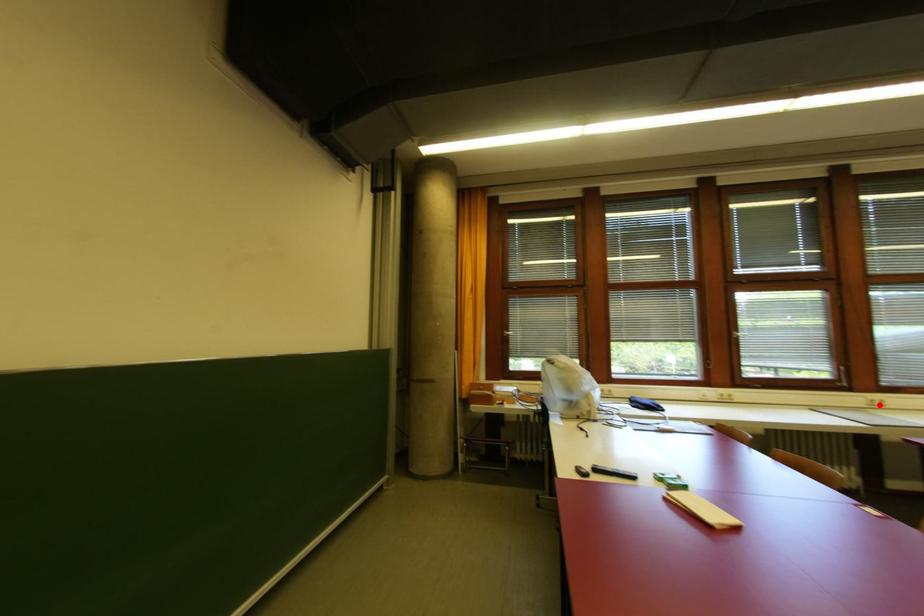
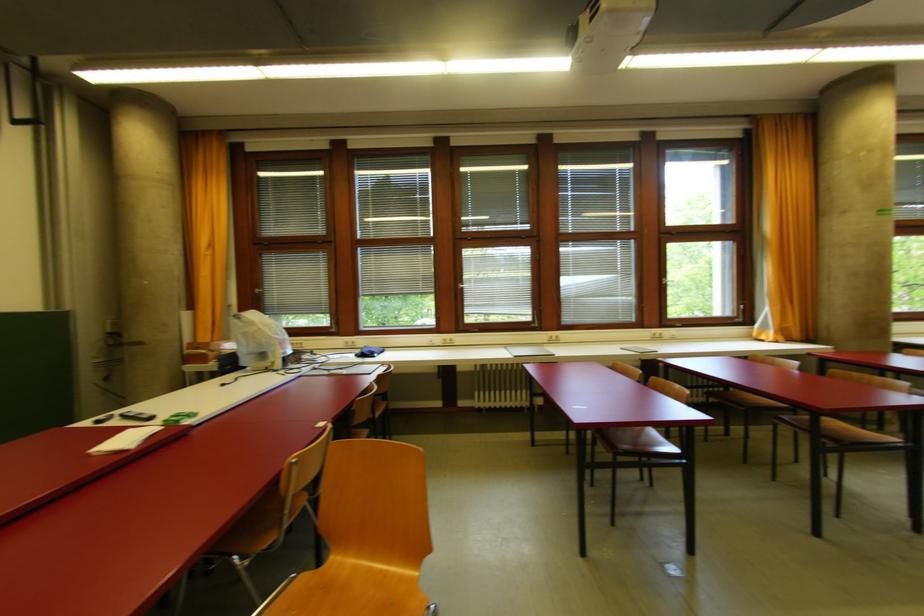
Question: I am providing you with two images of the same scene from different viewpoints. A red point is marked on the first image. Can you still see the location of the red point in image 2?

Choices:
 (A) Yes
 (B) No

Answer: (A)